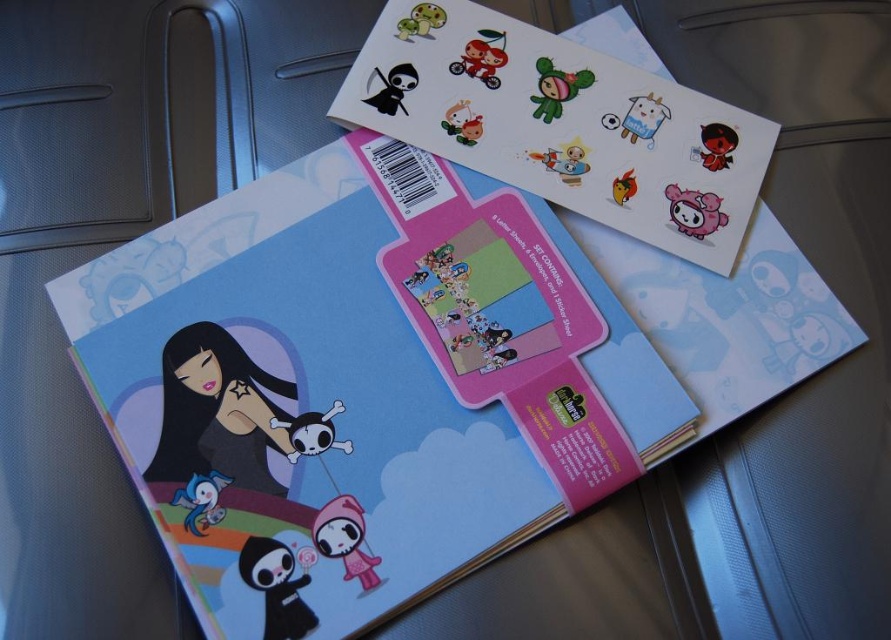
Can you confirm if matte paper envelope at center is positioned above transparent plastic stickers at upper center?

Actually, matte paper envelope at center is below transparent plastic stickers at upper center.

Image resolution: width=891 pixels, height=640 pixels. What do you see at coordinates (358, 385) in the screenshot? I see `matte paper envelope at center` at bounding box center [358, 385].

You are a GUI agent. You are given a task and a screenshot of the screen. Output one action in this format:
    pyautogui.click(x=<x>, y=<y>)
    Task: Click on the matte paper envelope at center
    
    Given the screenshot: What is the action you would take?
    pyautogui.click(x=358, y=385)